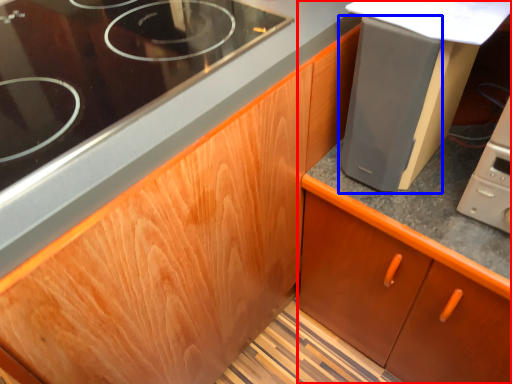
Question: Among these objects, which one is nearest to the camera, cabinetry (highlighted by a red box) or appliance (highlighted by a blue box)?

Choices:
 (A) cabinetry
 (B) appliance

Answer: (B)